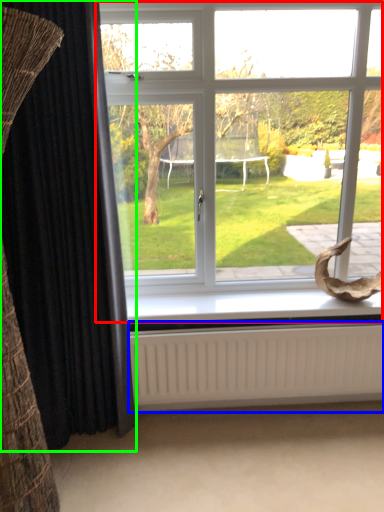
Question: Which is farther away from window (highlighted by a red box)? radiator (highlighted by a blue box) or curtain (highlighted by a green box)?

Choices:
 (A) radiator
 (B) curtain

Answer: (B)